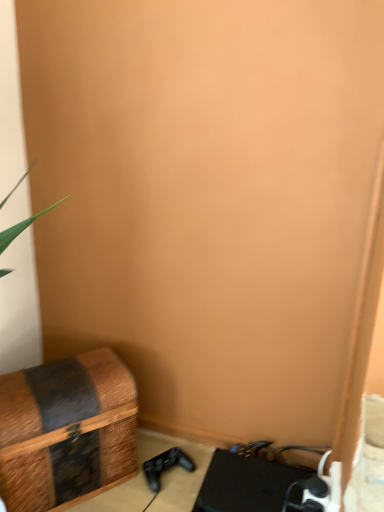
The height and width of the screenshot is (512, 384). What do you see at coordinates (66, 430) in the screenshot?
I see `woven wood chest at lower left` at bounding box center [66, 430].

Image resolution: width=384 pixels, height=512 pixels. What are the coordinates of `woven wood chest at lower left` in the screenshot? It's located at (66, 430).

The width and height of the screenshot is (384, 512). What are the coordinates of `woven wood chest at lower left` in the screenshot? It's located at (66, 430).